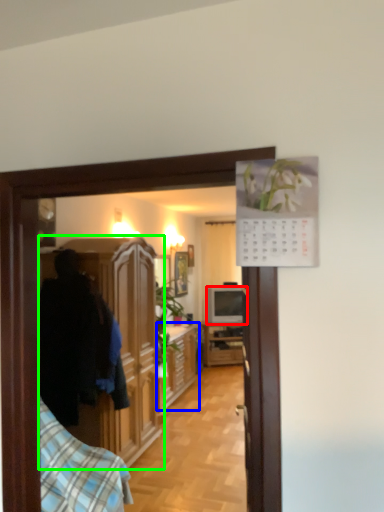
Question: Which object is positioned closest to television (highlighted by a red box)? Select from cabinetry (highlighted by a blue box) and cabinetry (highlighted by a green box).

Choices:
 (A) cabinetry
 (B) cabinetry

Answer: (A)